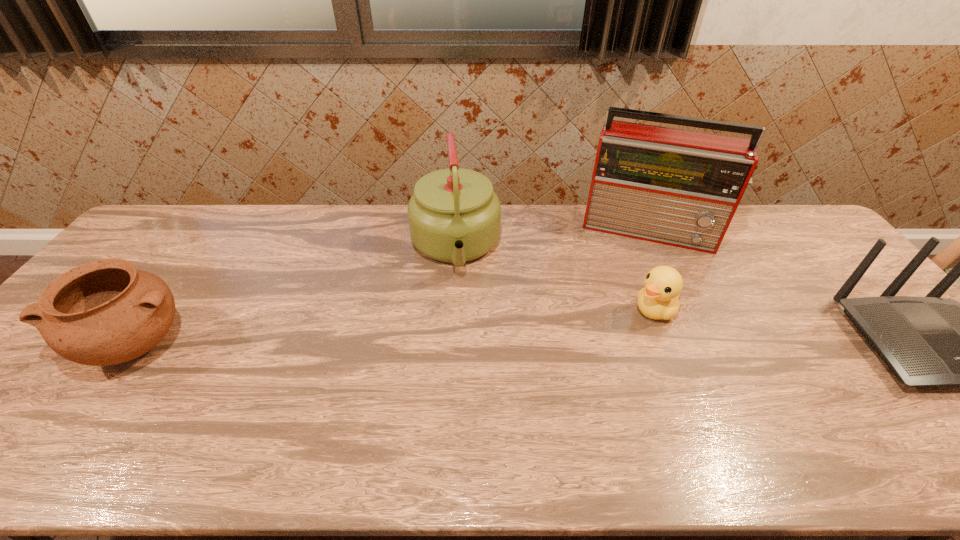
This screenshot has width=960, height=540. Find the location of `the leftmost object`. the leftmost object is located at coordinates (105, 312).

Find the location of a particular element. This screenshot has height=540, width=960. the shortest object is located at coordinates (659, 299).

This screenshot has height=540, width=960. Identify the location of radio receiver. (677, 187).

The width and height of the screenshot is (960, 540). What are the coordinates of `kettle` in the screenshot? It's located at (454, 215).

You are a GUI agent. You are given a task and a screenshot of the screen. Output one action in this format:
    pyautogui.click(x=<x>, y=<y>)
    Task: Click on the second object from left to right
    The height and width of the screenshot is (540, 960).
    Given the screenshot: What is the action you would take?
    pyautogui.click(x=454, y=215)

Find the location of `vacant space situated 0.400m on the back of the leftmost object`. vacant space situated 0.400m on the back of the leftmost object is located at coordinates (226, 223).

At what (x,y) coordinates should I click in order to perform the action: click on vacant space situated on the face of the duck. Please return your answer as a coordinate pair (x, y). Image resolution: width=960 pixels, height=540 pixels. Looking at the image, I should click on (530, 388).

Locate an element on the screen. vacant area located 0.370m on the face of the duck is located at coordinates (534, 386).

Identify the location of free space located 0.310m on the face of the duck. (553, 373).

Where is `vacant area situated on the front-facing side of the radio receiver`? vacant area situated on the front-facing side of the radio receiver is located at coordinates (632, 298).